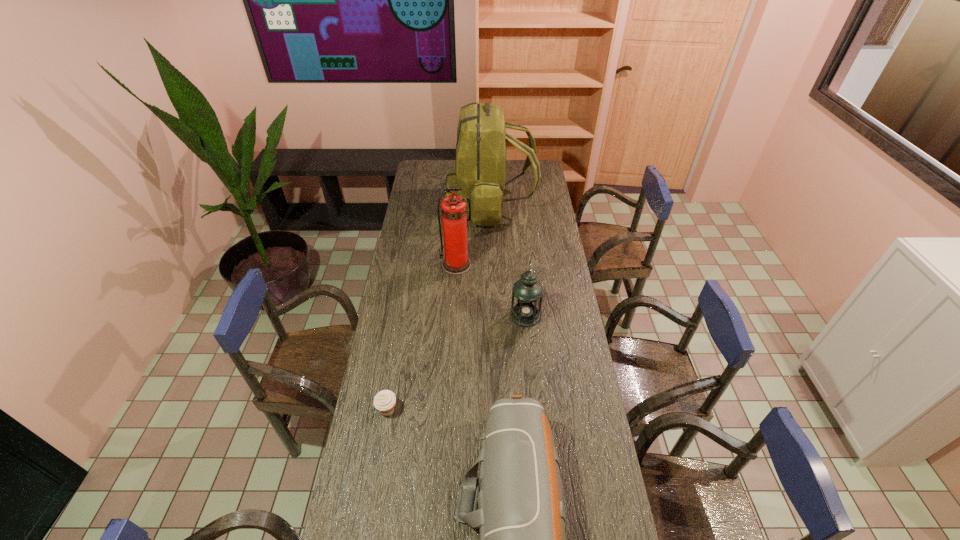
Where is `blank area at the right edge`? blank area at the right edge is located at coordinates (521, 194).

The width and height of the screenshot is (960, 540). I want to click on unoccupied position between the third tallest object and the fire extinguisher, so [x=491, y=291].

You are a GUI agent. You are given a task and a screenshot of the screen. Output one action in this format:
    pyautogui.click(x=<x>, y=<y>)
    Task: Click on the vacant area that lies between the tallest object and the oil lamp
    The image size is (960, 540).
    Given the screenshot: What is the action you would take?
    pyautogui.click(x=508, y=260)

Where is `empty space between the muffin and the fire extinguisher`? empty space between the muffin and the fire extinguisher is located at coordinates (421, 338).

What are the coordinates of `free spot between the oil lamp and the backpack` in the screenshot? It's located at (508, 260).

Locate an element on the screen. The image size is (960, 540). empty space that is in between the leftmost object and the third tallest object is located at coordinates (456, 363).

You are a GUI agent. You are given a task and a screenshot of the screen. Output one action in this format:
    pyautogui.click(x=<x>, y=<y>)
    Task: Click on the vacant area between the tallest object and the third nearest object
    The image size is (960, 540).
    Given the screenshot: What is the action you would take?
    pyautogui.click(x=508, y=260)

Locate which object ranks third in proximity to the third tallest object. Please provide its 2D coordinates. Your answer should be formatted as a tuple, i.e. [(x, y)], where the tuple contains the x and y coordinates of a point satisfying the conditions above.

[(481, 145)]

Identify the location of object that is the third nearest to the third nearest object. Image resolution: width=960 pixels, height=540 pixels. (481, 145).

Image resolution: width=960 pixels, height=540 pixels. In order to click on free space that satisfies the following two spatial constraints: 1. on the front-facing side of the tallest object; 2. on the back side of the third nearest object in this screenshot , I will do `click(492, 316)`.